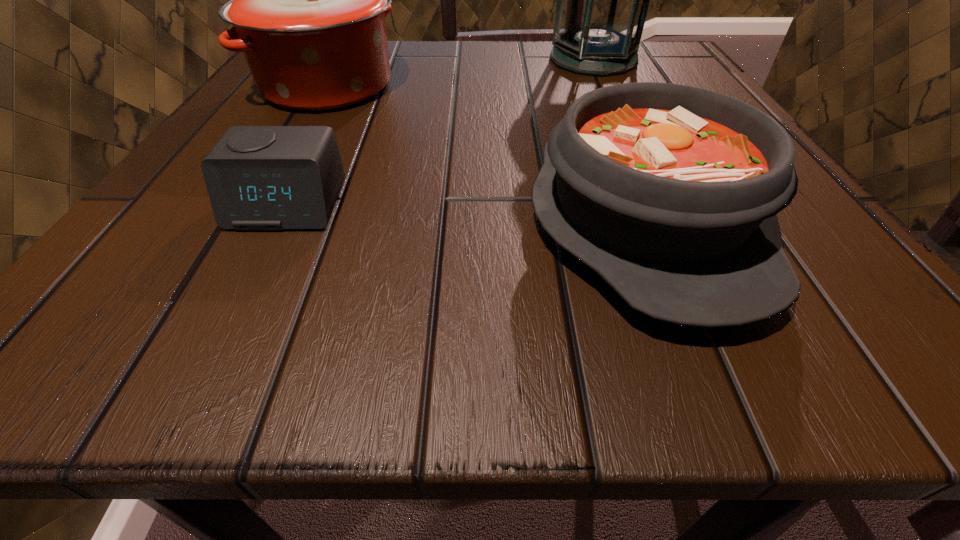
Locate which object is the second closest to the shorter casserole. Please provide its 2D coordinates. Your answer should be formatted as a tuple, i.e. [(x, y)], where the tuple contains the x and y coordinates of a point satisfying the conditions above.

[(258, 177)]

Choose which object is the third nearest neighbor to the shortest object. Please provide its 2D coordinates. Your answer should be formatted as a tuple, i.e. [(x, y)], where the tuple contains the x and y coordinates of a point satisfying the conditions above.

[(602, 0)]

Find the location of a particular element. vacant region that satisfies the following two spatial constraints: 1. on the front-facing side of the shortest object; 2. on the right side of the shorter casserole is located at coordinates (279, 221).

Locate an element on the screen. vacant space that satisfies the following two spatial constraints: 1. on the front side of the right casserole; 2. on the right side of the farther casserole is located at coordinates pos(250,221).